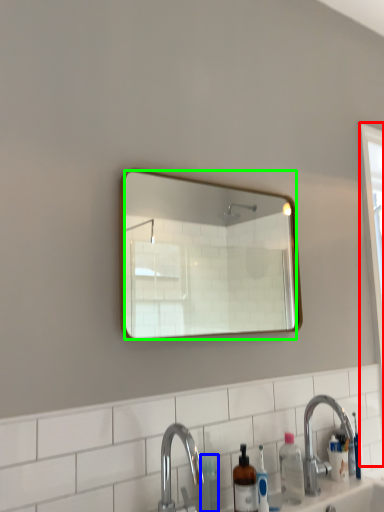
Question: Which is nearer to the screen door (highlighted by a red box)? toiletry (highlighted by a blue box) or mirror (highlighted by a green box).

Choices:
 (A) toiletry
 (B) mirror

Answer: (A)